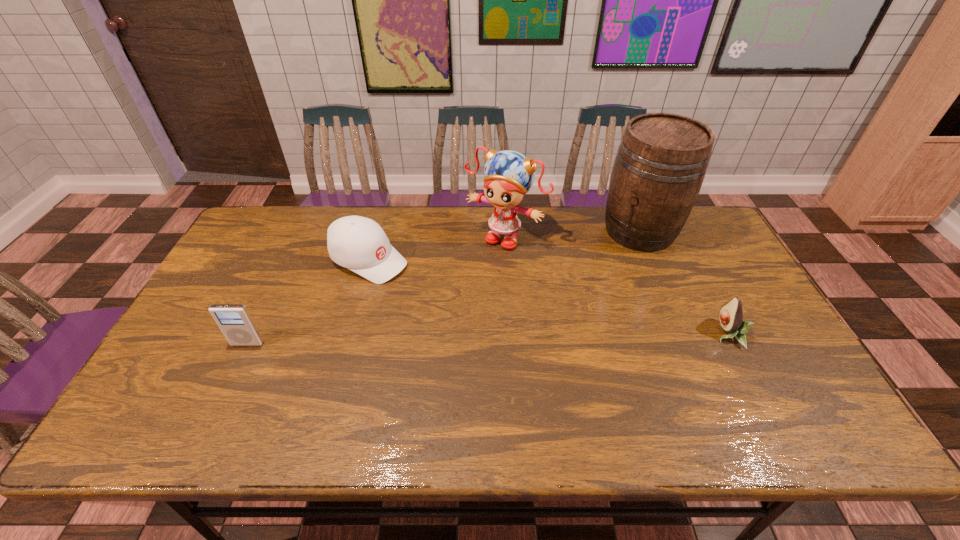
Image resolution: width=960 pixels, height=540 pixels. What are the coordinates of `free space at the far left corner of the desktop` in the screenshot? It's located at (293, 219).

The height and width of the screenshot is (540, 960). In order to click on free space between the tallest object and the avocado in this screenshot , I will do `click(684, 282)`.

Locate an element on the screen. free area in between the baseball cap and the avocado is located at coordinates (548, 297).

Identify the location of free point between the avocado and the cider. Image resolution: width=960 pixels, height=540 pixels. (684, 282).

The height and width of the screenshot is (540, 960). What are the coordinates of `free spot between the second object from left to right and the doll` in the screenshot? It's located at (437, 248).

The width and height of the screenshot is (960, 540). I want to click on vacant area between the tallest object and the avocado, so click(x=684, y=282).

I want to click on free space between the baseball cap and the avocado, so click(x=548, y=297).

Where is `blank region between the tallest object and the fourth shortest object`? This screenshot has width=960, height=540. blank region between the tallest object and the fourth shortest object is located at coordinates (572, 233).

Locate an element on the screen. object identified as the closest to the third object from right to left is located at coordinates (357, 243).

The image size is (960, 540). In order to click on object identified as the third closest to the tallest object in this screenshot , I will do `click(357, 243)`.